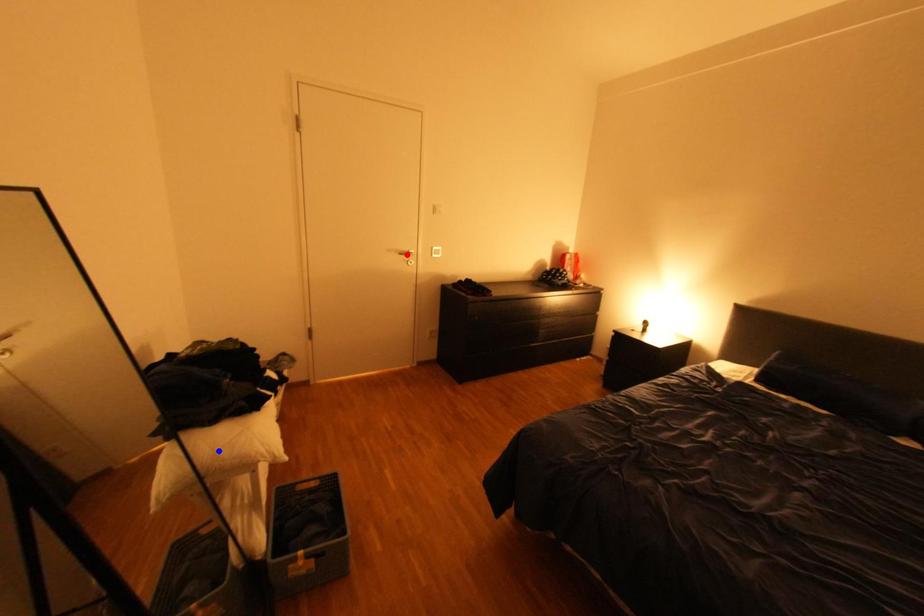
Question: Two points are marked on the image. Which point is closer to the camera?

Choices:
 (A) Blue point is closer.
 (B) Red point is closer.

Answer: (A)